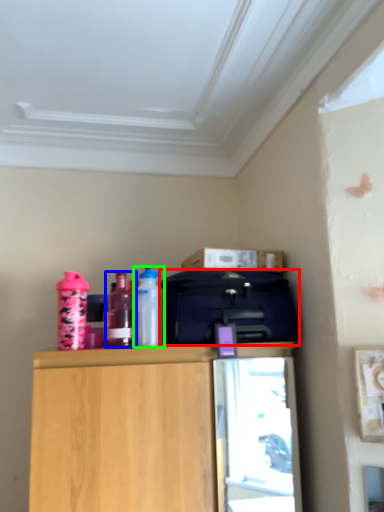
Question: Considering the real-world distances, which object is closest to luggage (highlighted by a red box)? bottle (highlighted by a blue box) or bottle (highlighted by a green box).

Choices:
 (A) bottle
 (B) bottle

Answer: (B)